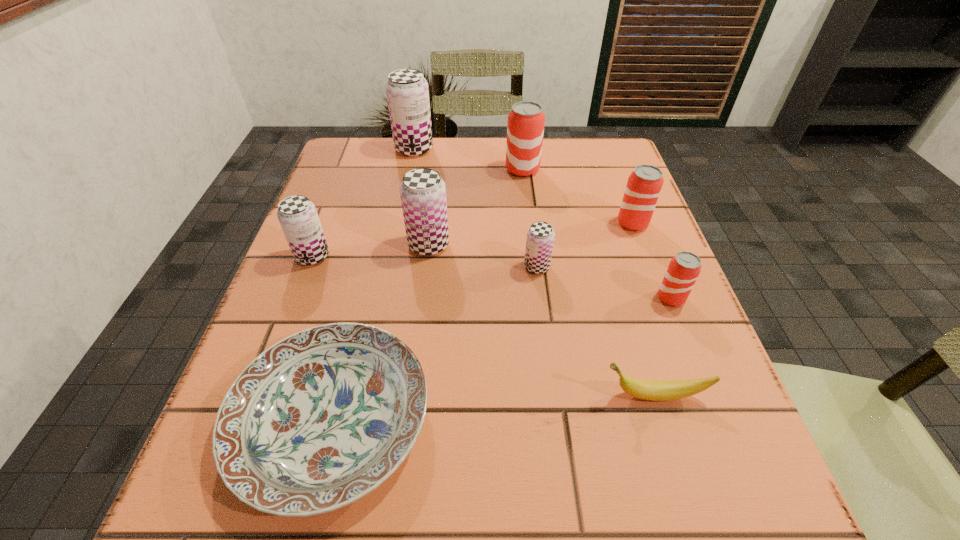
You are a GUI agent. You are given a task and a screenshot of the screen. Output one action in this format:
    pyautogui.click(x=<x>, y=<y>)
    Task: Click on the vacant space located 0.050m on the left of the nearest beer can
    The width and height of the screenshot is (960, 540).
    Given the screenshot: What is the action you would take?
    pyautogui.click(x=631, y=298)

Image resolution: width=960 pixels, height=540 pixels. In order to click on free point located 0.060m at the stem of the second shortest object in this screenshot , I will do [x=562, y=395].

Locate an element on the screen. This screenshot has width=960, height=540. vacant space located at the stem of the second shortest object is located at coordinates (452, 395).

You are a GUI agent. You are given a task and a screenshot of the screen. Output one action in this format:
    pyautogui.click(x=<x>, y=<y>)
    Task: Click on the free point located 0.170m at the stem of the second shortest object
    The height and width of the screenshot is (540, 960).
    Given the screenshot: What is the action you would take?
    pyautogui.click(x=491, y=395)

I want to click on blank space located 0.290m on the right of the plate, so click(x=623, y=421).

Where is `object present at the near edge`? The image size is (960, 540). object present at the near edge is located at coordinates (318, 420).

What are the coordinates of `plate present at the left edge` in the screenshot? It's located at (318, 420).

Locate an element on the screen. This screenshot has width=960, height=540. banana positioned at the right edge is located at coordinates (654, 390).

Identify the location of object at the far left corner. This screenshot has width=960, height=540. (407, 91).

Where is `object that is positioned at the near left corner`? This screenshot has height=540, width=960. object that is positioned at the near left corner is located at coordinates (318, 420).